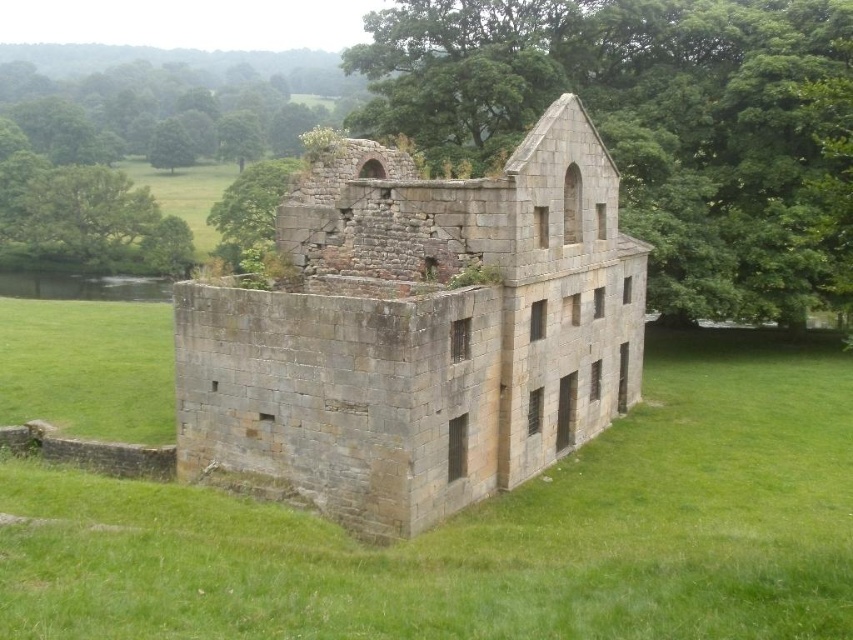
Question: Is green grass at center closer to camera compared to green leafy tree at upper left?

Choices:
 (A) yes
 (B) no

Answer: (A)

Question: Which object appears closest to the camera in this image?

Choices:
 (A) green leafy tree at upper center
 (B) green leafy tree at upper left
 (C) gray stone castle at center

Answer: (A)

Question: Where is green grass at center located in relation to gray stone castle at center in the image?

Choices:
 (A) right
 (B) left

Answer: (B)

Question: Based on their relative distances, which object is nearer to the green leafy tree at upper center?

Choices:
 (A) green leafy tree at upper left
 (B) green grass at center
 (C) gray stone castle at center

Answer: (C)

Question: Among these points, which one is nearest to the camera?

Choices:
 (A) (73, 262)
 (B) (672, 308)
 (C) (265, 384)

Answer: (C)

Question: Is gray stone castle at center thinner than green leafy tree at upper center?

Choices:
 (A) no
 (B) yes

Answer: (B)